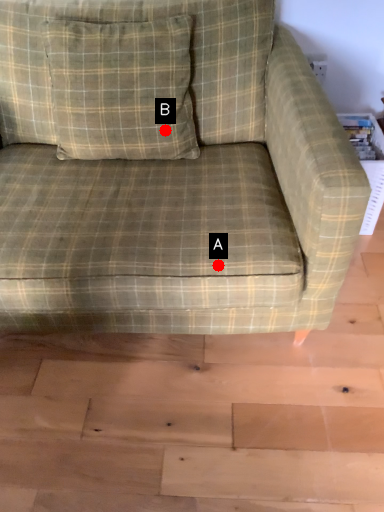
Question: Two points are circled on the image, labeled by A and B beside each circle. Which point is farther to the camera?

Choices:
 (A) A is further
 (B) B is further

Answer: (B)